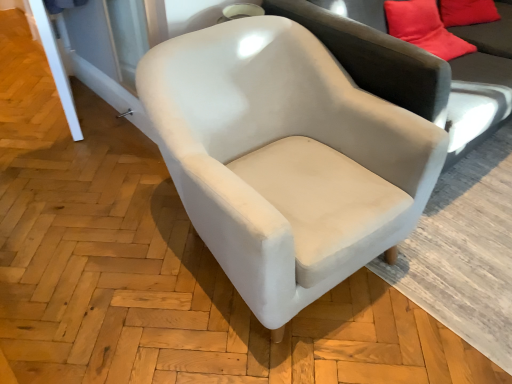
This screenshot has width=512, height=384. What do you see at coordinates (415, 75) in the screenshot?
I see `suede-like beige couch at center` at bounding box center [415, 75].

Find the location of a particular element. The width and height of the screenshot is (512, 384). suede-like beige couch at center is located at coordinates pos(415,75).

I want to click on white velvet chair at center, so click(285, 158).

Measure the distance between point (260,74) and camera.

They are 1.56 meters apart.

What do you see at coordinates (285, 158) in the screenshot? I see `white velvet chair at center` at bounding box center [285, 158].

Find the location of `suede-like beige couch at center`. suede-like beige couch at center is located at coordinates (415, 75).

Which object is positioned more to the left, white velvet chair at center or suede-like beige couch at center?

From the viewer's perspective, white velvet chair at center appears more on the left side.

From the picture: Considering their positions, is white velvet chair at center located in front of or behind suede-like beige couch at center?

white velvet chair at center is positioned closer to the viewer than suede-like beige couch at center.

Which is nearer, (432, 167) or (496, 79)?

The point (432, 167) is closer.

From the image's perspective, which is below, white velvet chair at center or suede-like beige couch at center?

From the image's view, white velvet chair at center is below.

From a real-world perspective, who is located lower, white velvet chair at center or suede-like beige couch at center?

In real-world perspective, white velvet chair at center is lower.

Does white velvet chair at center have a lesser width compared to suede-like beige couch at center?

Indeed, white velvet chair at center has a lesser width compared to suede-like beige couch at center.

Between white velvet chair at center and suede-like beige couch at center, which one has more height?

suede-like beige couch at center.

Considering the relative sizes of white velvet chair at center and suede-like beige couch at center in the image provided, is white velvet chair at center bigger than suede-like beige couch at center?

Incorrect, white velvet chair at center is not larger than suede-like beige couch at center.

Would you say white velvet chair at center contains suede-like beige couch at center?

That's incorrect, suede-like beige couch at center is not inside white velvet chair at center.

Consider the image. Are white velvet chair at center and suede-like beige couch at center far apart?

No, white velvet chair at center is in close proximity to suede-like beige couch at center.

Is suede-like beige couch at center at the back of white velvet chair at center?

No.

The image size is (512, 384). I want to click on chair that appears on the left of suede-like beige couch at center, so click(285, 158).

Which object is positioned more to the left, suede-like beige couch at center or white velvet chair at center?

Positioned to the left is white velvet chair at center.

Which is in front, suede-like beige couch at center or white velvet chair at center?

white velvet chair at center.

Which point is more distant from viewer, (305,12) or (234,94)?

Point (234,94)

From the image's perspective, who appears lower, suede-like beige couch at center or white velvet chair at center?

white velvet chair at center appears lower in the image.

From a real-world perspective, is suede-like beige couch at center under white velvet chair at center?

No, from a real-world perspective, suede-like beige couch at center is not under white velvet chair at center.

Between suede-like beige couch at center and white velvet chair at center, which one has smaller width?

white velvet chair at center is thinner.

Which of these two, suede-like beige couch at center or white velvet chair at center, stands taller?

suede-like beige couch at center.

From the picture: Is suede-like beige couch at center bigger or smaller than white velvet chair at center?

suede-like beige couch at center is bigger than white velvet chair at center.

Is white velvet chair at center inside suede-like beige couch at center?

No, white velvet chair at center is located outside of suede-like beige couch at center.

Is suede-like beige couch at center in contact with white velvet chair at center?

There is a gap between suede-like beige couch at center and white velvet chair at center.

Is suede-like beige couch at center aimed at white velvet chair at center?

No, suede-like beige couch at center is not oriented towards white velvet chair at center.

Measure the distance from suede-like beige couch at center to white velvet chair at center.

suede-like beige couch at center is 16.64 inches from white velvet chair at center.

Where is `chair that appears on the left of suede-like beige couch at center`? Image resolution: width=512 pixels, height=384 pixels. chair that appears on the left of suede-like beige couch at center is located at coordinates (285, 158).

Where is `chair in front of the suede-like beige couch at center`? chair in front of the suede-like beige couch at center is located at coordinates (285, 158).

The image size is (512, 384). In order to click on studio couch that appears above the white velvet chair at center (from a real-world perspective) in this screenshot , I will do `click(415, 75)`.